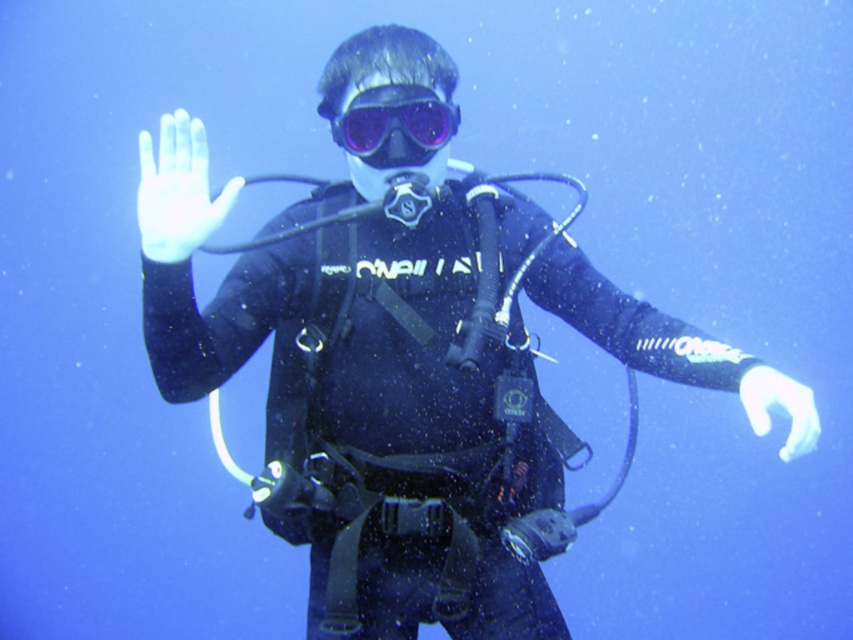
Which is more to the right, transparent rubber mask at center or white matte glove at lower right?

From the viewer's perspective, white matte glove at lower right appears more on the right side.

Who is taller, transparent rubber mask at center or white matte glove at lower right?

With more height is transparent rubber mask at center.

Image resolution: width=853 pixels, height=640 pixels. I want to click on transparent rubber mask at center, so click(x=390, y=106).

You are a GUI agent. You are given a task and a screenshot of the screen. Output one action in this format:
    pyautogui.click(x=<x>, y=<y>)
    Task: Click on the transparent rubber mask at center
    
    Given the screenshot: What is the action you would take?
    pyautogui.click(x=390, y=106)

In the scene shown: Who is lower down, purple matte/glossy goggles at center or white matte glove at lower right?

white matte glove at lower right is below.

Is purple matte/glossy goggles at center bigger than white matte glove at lower right?

Incorrect, purple matte/glossy goggles at center is not larger than white matte glove at lower right.

Is point (361, 109) farther from camera compared to point (785, 442)?

No, it is in front of (785, 442).

In order to click on purple matte/glossy goggles at center in this screenshot , I will do `click(396, 122)`.

Measure the distance between white matte glove at center and white matte glove at lower right.

The distance of white matte glove at center from white matte glove at lower right is 38.14 inches.

Is point (149, 205) closer to camera compared to point (775, 378)?

That is False.

Locate an element on the screen. This screenshot has height=640, width=853. white matte glove at center is located at coordinates (178, 189).